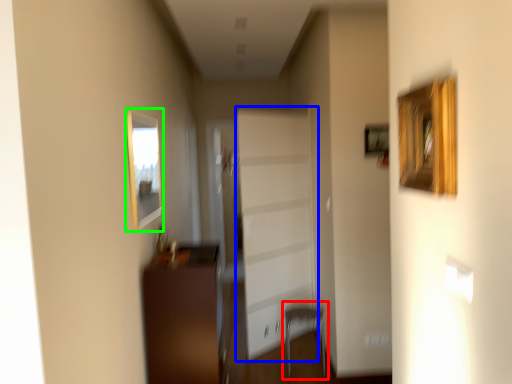
Question: Which is farther away from armchair (highlighted by a red box)? garage door (highlighted by a blue box) or picture frame (highlighted by a green box)?

Choices:
 (A) garage door
 (B) picture frame

Answer: (B)